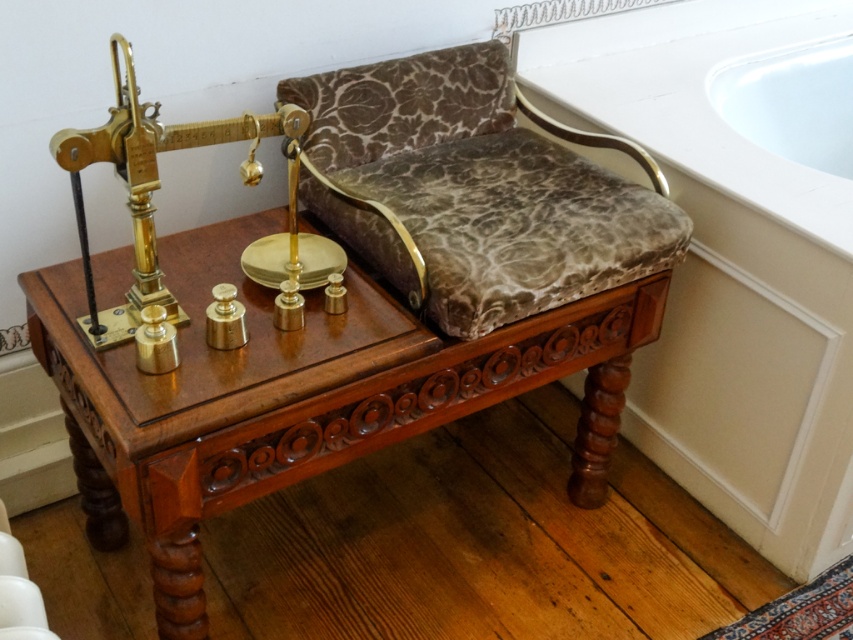
Question: Observing the image, what is the correct spatial positioning of mahogany wood table at center in reference to white glossy bathtub at upper right?

Choices:
 (A) right
 (B) left

Answer: (B)

Question: Is the position of mahogany wood table at center more distant than that of white glossy bathtub at upper right?

Choices:
 (A) yes
 (B) no

Answer: (B)

Question: Which point is closer to the camera?

Choices:
 (A) white glossy bathtub at upper right
 (B) mahogany wood table at center

Answer: (B)

Question: Which of the following is the farthest from the observer?

Choices:
 (A) mahogany wood table at center
 (B) white glossy bathtub at upper right

Answer: (B)

Question: Is the position of mahogany wood table at center more distant than that of white glossy bathtub at upper right?

Choices:
 (A) no
 (B) yes

Answer: (A)